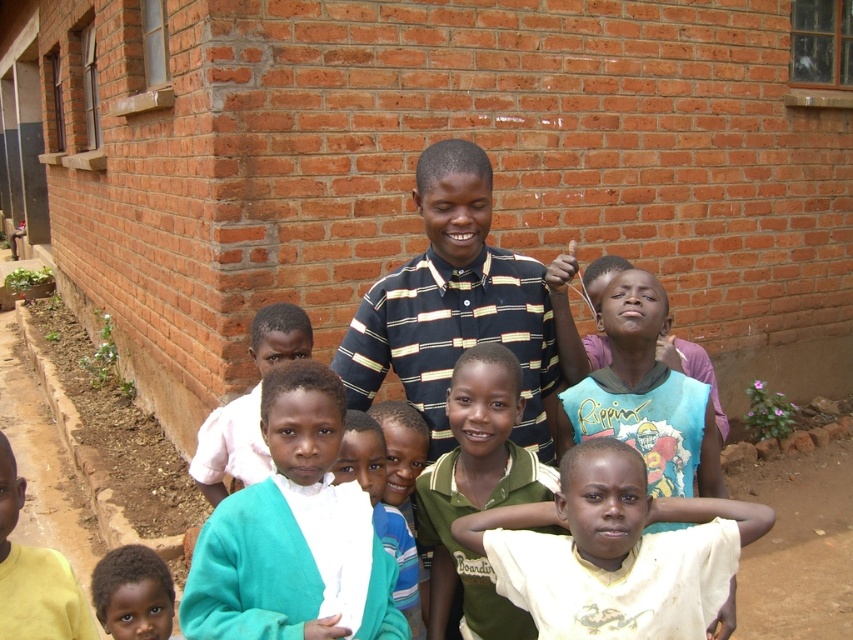
Question: Can you confirm if teal sweater at center is positioned to the left of dark brown skin at lower left?

Choices:
 (A) yes
 (B) no

Answer: (B)

Question: Which of the following is the closest to the observer?

Choices:
 (A) (120, 564)
 (B) (643, 483)
 (C) (186, 628)
 (D) (537, 291)

Answer: (C)

Question: Which point is farther to the camera?

Choices:
 (A) (473, 214)
 (B) (352, 486)
 (C) (270, 330)

Answer: (C)

Question: Does striped cotton shirt at center lie in front of dark brown skin at lower left?

Choices:
 (A) yes
 (B) no

Answer: (B)

Question: Which of these objects is positioned closest to the teal fabric shirt at center?

Choices:
 (A) teal sweater at center
 (B) dark brown skin at lower left
 (C) white matte shirt at lower center
 (D) striped cotton shirt at center

Answer: (D)

Question: Is white matte shirt at lower center positioned in front of dark brown skin at lower left?

Choices:
 (A) no
 (B) yes

Answer: (B)